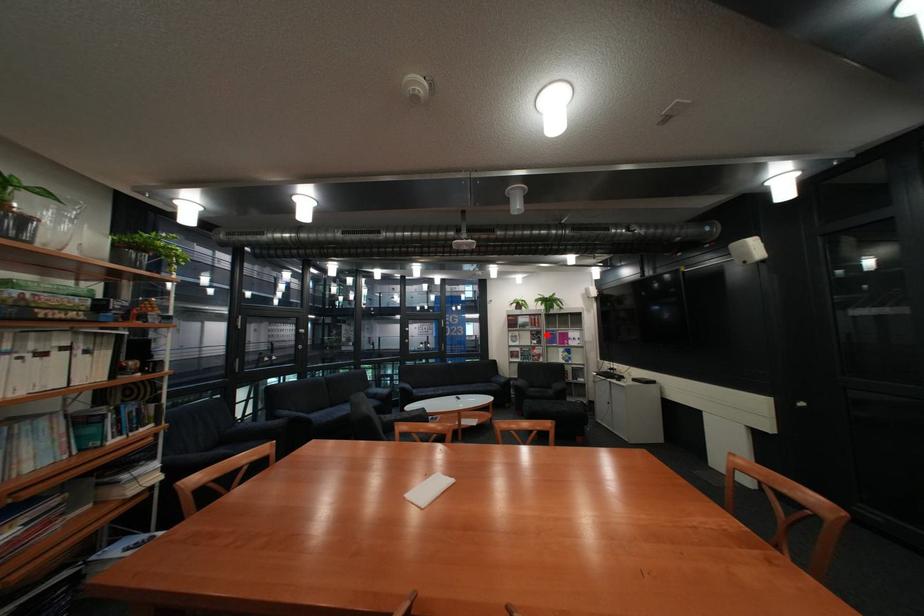
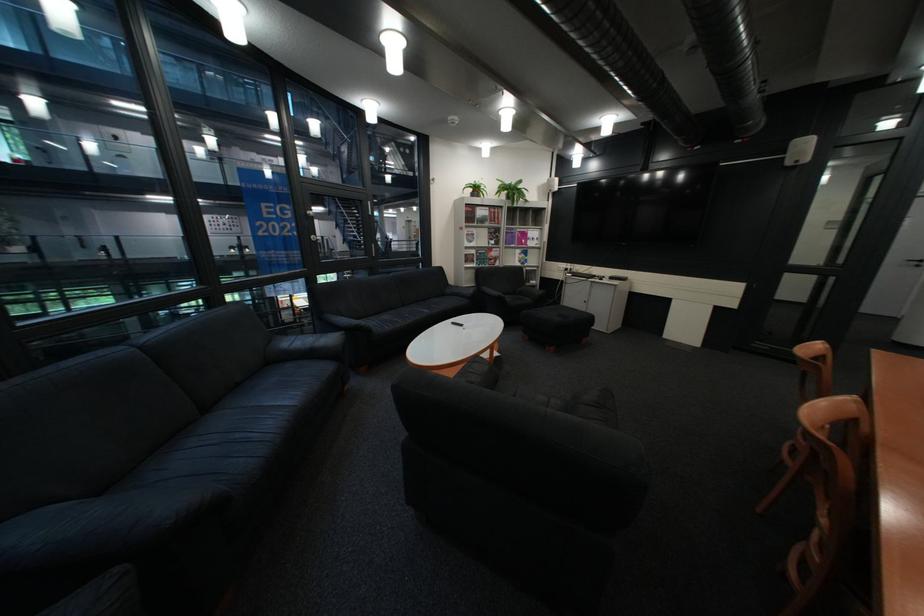
Where in the second image is the point corresponding to the highlighted location from the first image?

(505, 233)